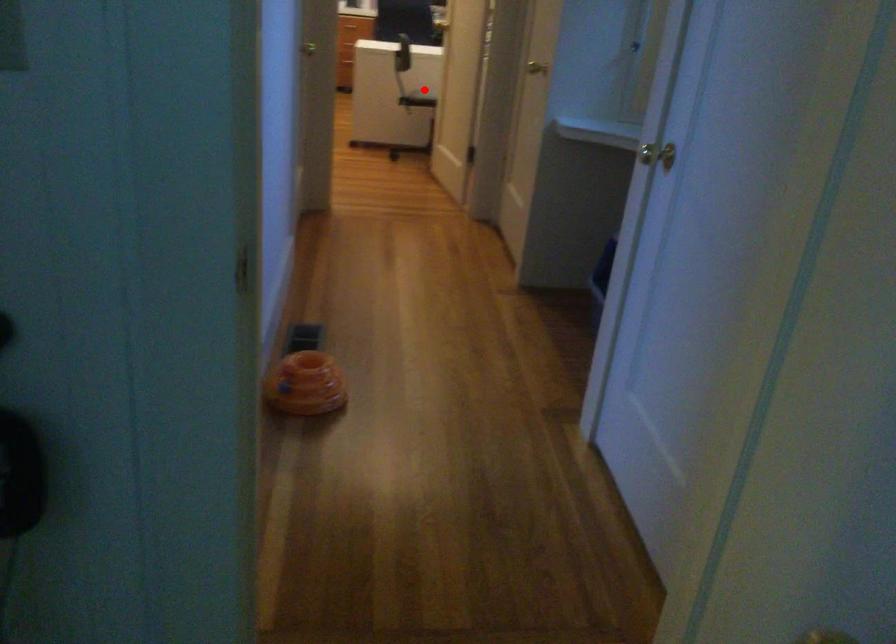
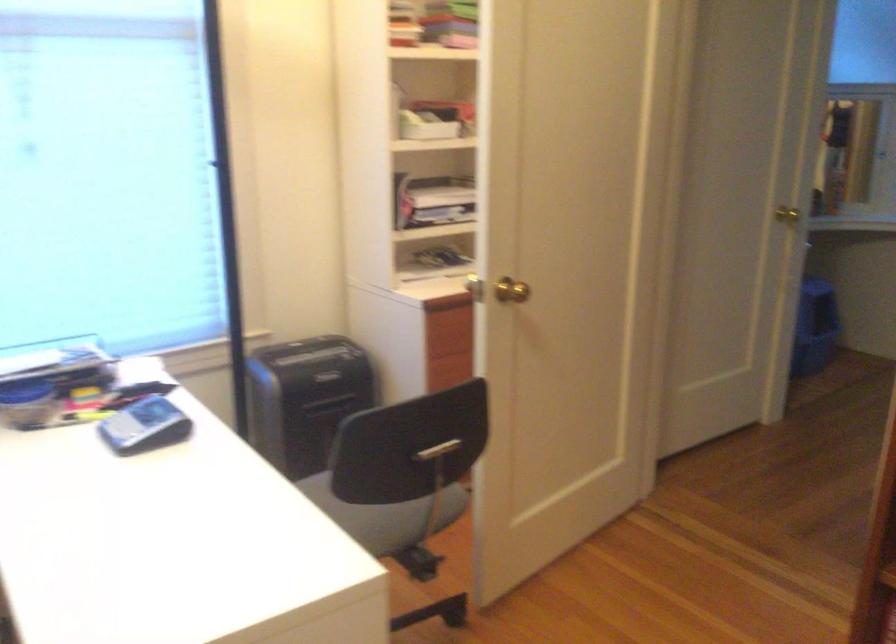
Find the pixel in the second image that matches the highlighted location in the first image.

(383, 515)